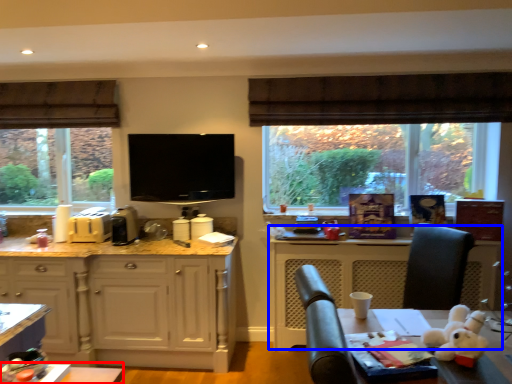
Question: Which of the following is the closest to the observer, table (highlighted by a red box) or counter (highlighted by a blue box)?

Choices:
 (A) table
 (B) counter

Answer: (A)